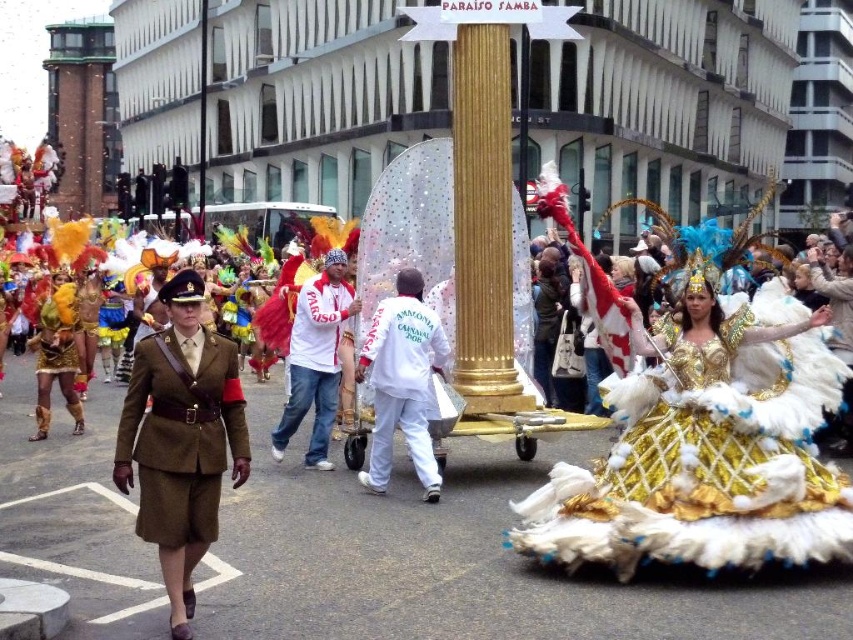
Is point (276, 435) farther from viewer compared to point (62, 296)?

No, it is in front of (62, 296).

How far apart are white matte shirt at center and shiny gold costume at left?

white matte shirt at center and shiny gold costume at left are 14.37 meters apart from each other.

Is point (274, 456) closer to camera compared to point (65, 400)?

Yes, point (274, 456) is closer to viewer.

Locate an element on the screen. Image resolution: width=853 pixels, height=640 pixels. white matte shirt at center is located at coordinates (316, 358).

Does gold sequined dress at center appear over shiny gold costume at left?

Actually, gold sequined dress at center is below shiny gold costume at left.

Which is behind, point (735, 316) or point (57, 346)?

The point (57, 346) is more distant.

This screenshot has width=853, height=640. In order to click on gold sequined dress at center in this screenshot , I will do `click(706, 458)`.

Is gold sequined dress at center behind white matte uniform at center?

No.

Which is behind, point (715, 413) or point (437, 484)?

The point (437, 484) is behind.

Who is more distant from viewer, (579,524) or (386,374)?

Positioned behind is point (386,374).

In order to click on gold sequined dress at center in this screenshot , I will do [706, 458].